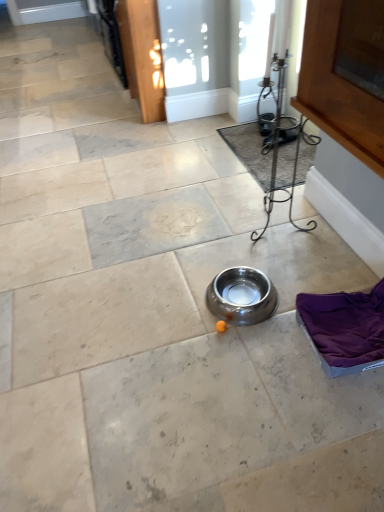
Identify the location of vacant space behind silver metallic bowl at center. (226, 256).